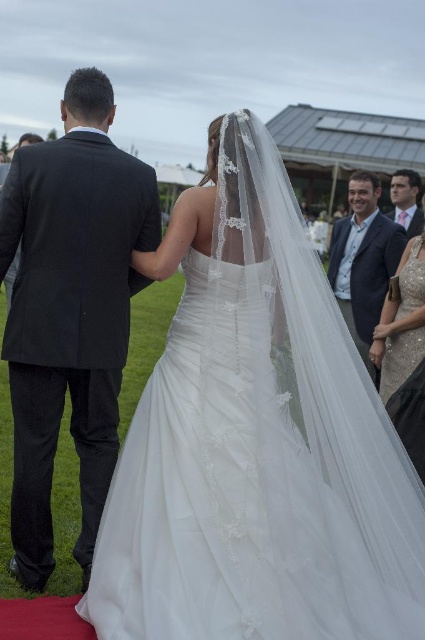
Between dark gray suit at left and matte pink shirt at upper right, which one appears on the left side from the viewer's perspective?

dark gray suit at left is more to the left.

Is dark gray suit at left positioned in front of matte pink shirt at upper right?

That is True.

Between point (127, 212) and point (405, 225), which one is positioned behind?

The point (405, 225) is behind.

Locate an element on the screen. dark gray suit at left is located at coordinates (70, 310).

Is point (385, 275) closer to camera compared to point (382, 305)?

No, (385, 275) is behind (382, 305).

Find the location of a particular element. dark blue suit at right is located at coordinates (363, 260).

Is white tulle dress at center below matte pink shirt at upper right?

Correct, white tulle dress at center is located below matte pink shirt at upper right.

Image resolution: width=425 pixels, height=640 pixels. Describe the element at coordinates (255, 440) in the screenshot. I see `white tulle dress at center` at that location.

At what (x,y) coordinates should I click in order to perform the action: click on white tulle dress at center. Please return your answer as a coordinate pair (x, y). Image resolution: width=425 pixels, height=640 pixels. Looking at the image, I should click on (255, 440).